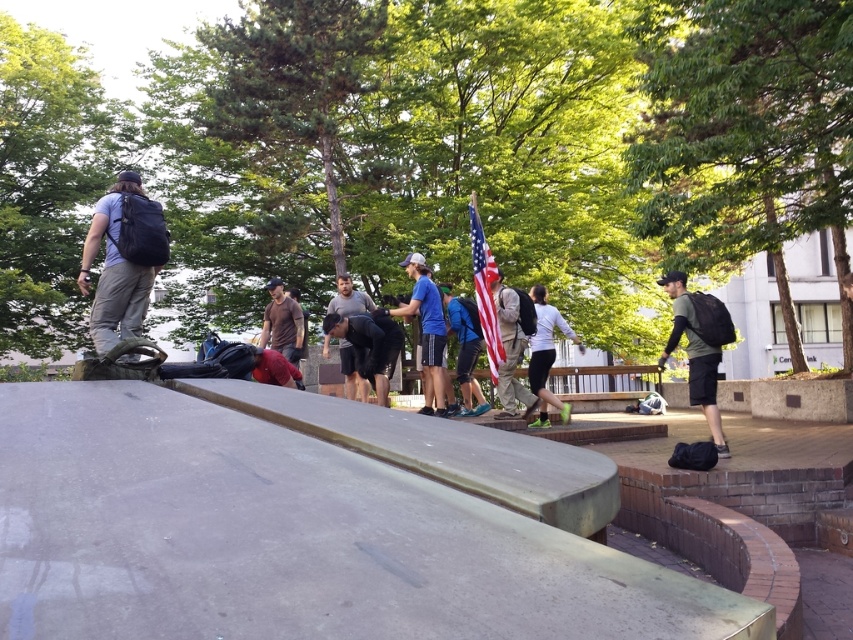
Is matte green t-shirt at right to the right of blue fabric shirt at center from the viewer's perspective?

Indeed, matte green t-shirt at right is positioned on the right side of blue fabric shirt at center.

Which is more to the left, matte green t-shirt at right or blue fabric shirt at center?

blue fabric shirt at center is more to the left.

Does point (662, 282) lie in front of point (440, 344)?

Yes, it is in front of point (440, 344).

Locate an element on the screen. This screenshot has height=640, width=853. matte green t-shirt at right is located at coordinates (694, 355).

What do you see at coordinates (694, 355) in the screenshot?
I see `matte green t-shirt at right` at bounding box center [694, 355].

Is matte green t-shirt at right to the right of dark gray fabric backpack at center from the viewer's perspective?

Indeed, matte green t-shirt at right is positioned on the right side of dark gray fabric backpack at center.

Does point (705, 349) come in front of point (349, 392)?

Yes, it is in front of point (349, 392).

Where is `matte green t-shirt at right`? This screenshot has width=853, height=640. matte green t-shirt at right is located at coordinates (694, 355).

Can you confirm if american flag at center is positioned to the right of brown matte shirt at center?

Indeed, american flag at center is positioned on the right side of brown matte shirt at center.

Locate an element on the screen. This screenshot has height=640, width=853. american flag at center is located at coordinates (485, 289).